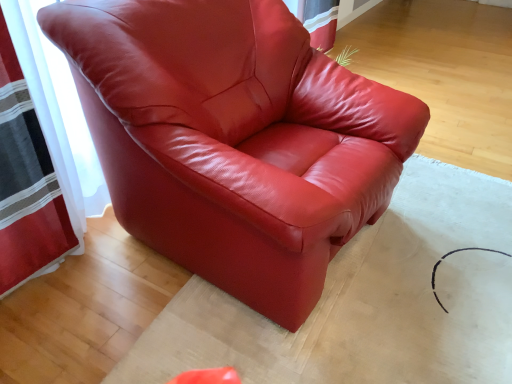
This screenshot has width=512, height=384. Find the location of `matte red leather armchair at center`. matte red leather armchair at center is located at coordinates (234, 139).

Measure the distance between point (277, 4) and camera.

Point (277, 4) and camera are 1.60 meters apart from each other.

Describe the element at coordinates (234, 139) in the screenshot. I see `matte red leather armchair at center` at that location.

Locate an element on the screen. matte red leather armchair at center is located at coordinates (234, 139).